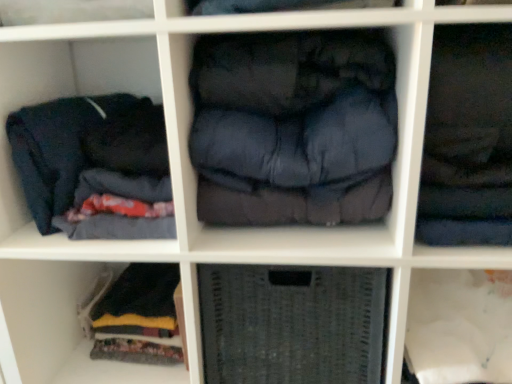
Question: Based on their sizes in the image, would you say dark blue quilted jacket at center, the second clothing viewed from the right, is bigger or smaller than dark blue fabric at upper right, the first clothing from the right?

Choices:
 (A) small
 (B) big

Answer: (B)

Question: From the image's perspective, is dark blue quilted jacket at center, the second clothing viewed from the right, located above or below dark blue fabric at upper right, the first clothing from the right?

Choices:
 (A) below
 (B) above

Answer: (A)

Question: Which is nearer to the gray woven basket at center?

Choices:
 (A) dark blue quilted jacket at center, which is counted as the second clothing, starting from the left
 (B) dark blue fabric at left, which is the 1th clothing in left-to-right order
 (C) dark blue fabric at upper right, which is counted as the third clothing, starting from the left

Answer: (A)

Question: Which is nearer to the dark blue fabric at upper right, which is counted as the third clothing, starting from the left?

Choices:
 (A) dark blue quilted jacket at center, the second clothing viewed from the right
 (B) dark blue fabric at left, which is the 1th clothing in left-to-right order
 (C) gray woven basket at center

Answer: (A)